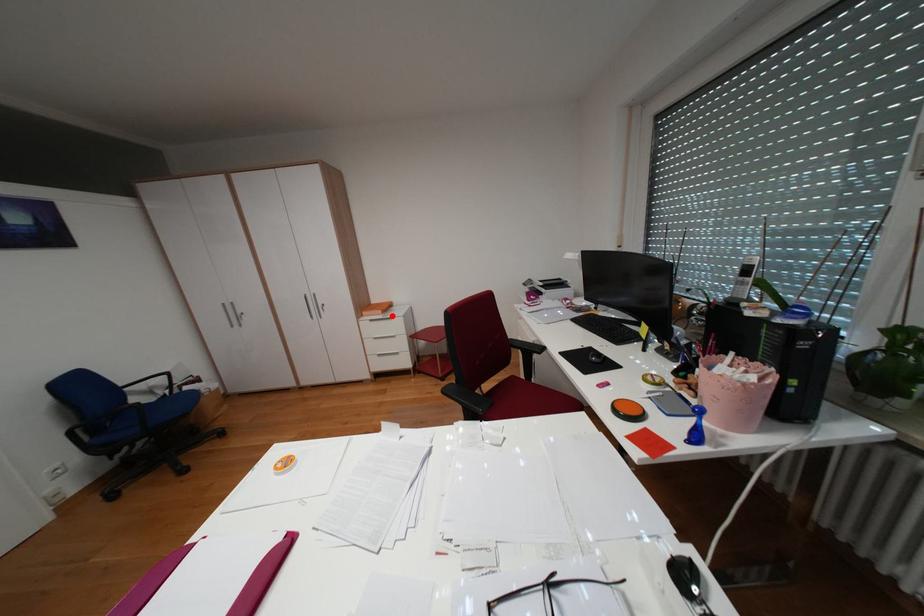
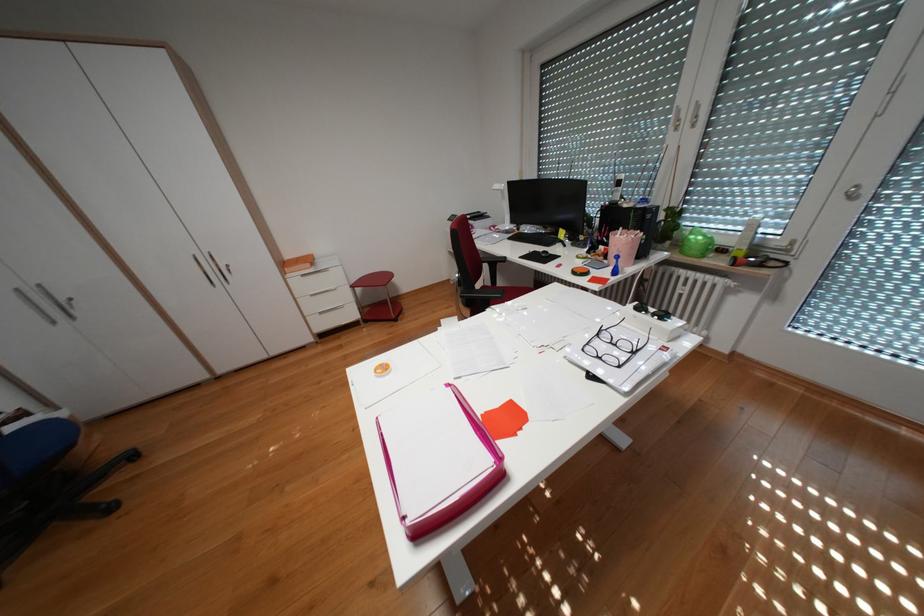
Question: I am providing you with two images of the same scene from different viewpoints. A red point is shown in image1. For the corresponding object point in image2, is it positioned nearer or farther from the camera?

Choices:
 (A) Nearer
 (B) Farther

Answer: (A)